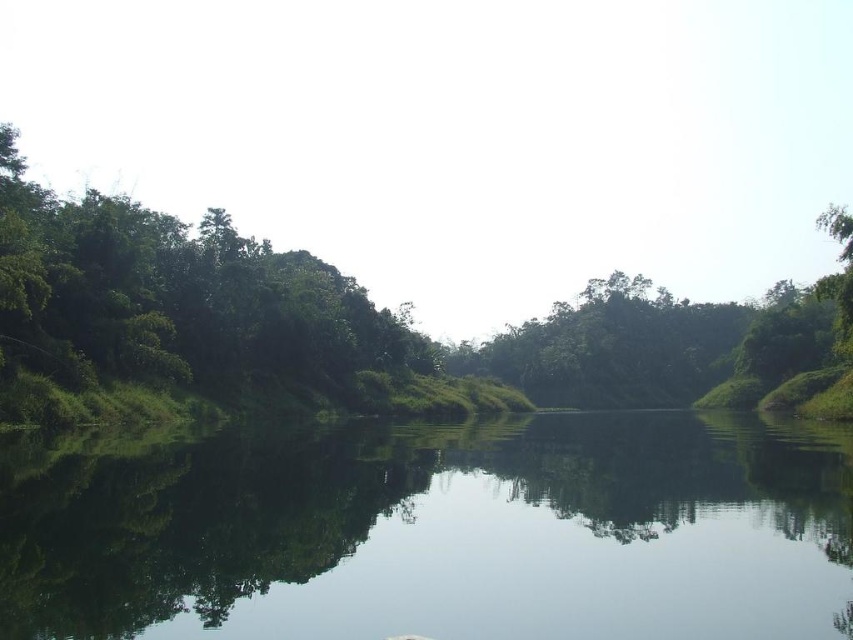
This screenshot has height=640, width=853. What do you see at coordinates (440, 534) in the screenshot? I see `transparent water at center` at bounding box center [440, 534].

Can you confirm if transparent water at center is positioned to the left of green leafy tree at center?

Correct, you'll find transparent water at center to the left of green leafy tree at center.

This screenshot has height=640, width=853. What are the coordinates of `transparent water at center` in the screenshot? It's located at (440, 534).

Locate an element on the screen. transparent water at center is located at coordinates (440, 534).